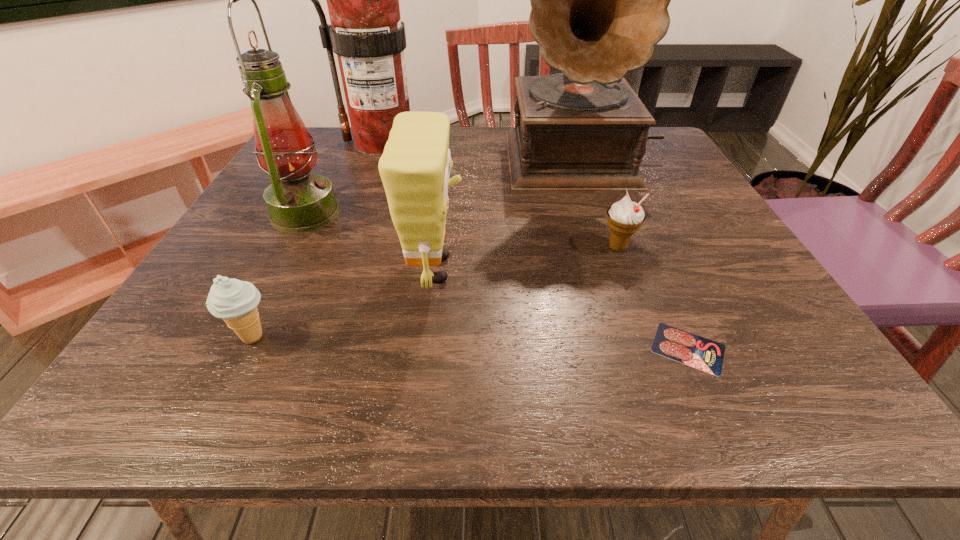
At what (x,y) coordinates should I click in order to perform the action: click on free space at the far right corner. Please return your answer as a coordinate pair (x, y). This screenshot has height=540, width=960. Looking at the image, I should click on (675, 157).

Locate an element on the screen. vacant space at the near right corner of the desktop is located at coordinates (808, 382).

Locate an element on the screen. This screenshot has width=960, height=540. vacant area that lies between the oil lamp and the fire extinguisher is located at coordinates (344, 178).

Find the location of a particular element. Image resolution: width=960 pixels, height=540 pixels. free area in between the fifth shortest object and the nearer icecream is located at coordinates (278, 275).

Where is `vacant space that's between the record player and the fire extinguisher`? vacant space that's between the record player and the fire extinguisher is located at coordinates (483, 150).

At what (x,y) coordinates should I click in order to perform the action: click on vacant space in between the record player and the salami. Please return your answer as a coordinate pair (x, y). The image size is (960, 540). Looking at the image, I should click on (636, 253).

The height and width of the screenshot is (540, 960). Find the location of `vacant space that is in between the fire extinguisher and the record player`. vacant space that is in between the fire extinguisher and the record player is located at coordinates (x=483, y=150).

Locate an element on the screen. free space between the shortest object and the oil lamp is located at coordinates (496, 281).

Where is `blank region between the farther icecream and the fire extinguisher`? Image resolution: width=960 pixels, height=540 pixels. blank region between the farther icecream and the fire extinguisher is located at coordinates (500, 195).

Find the location of `vacant point located between the oil lamp and the farther icecream`. vacant point located between the oil lamp and the farther icecream is located at coordinates (462, 231).